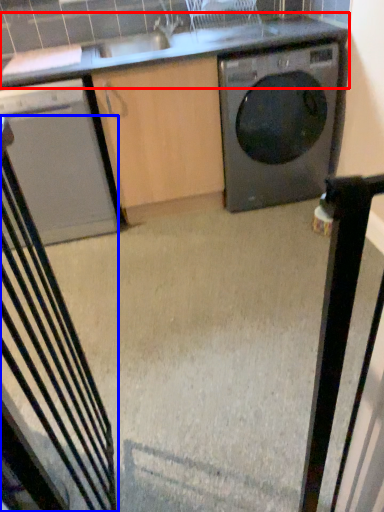
Question: Which point is closer to the camera, countertop (highlighted by a red box) or rocking chair (highlighted by a blue box)?

Choices:
 (A) countertop
 (B) rocking chair

Answer: (B)